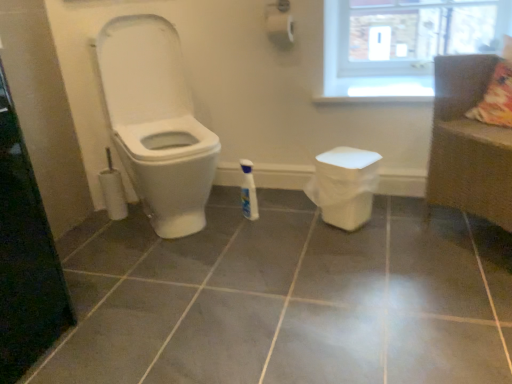
Question: Does white glossy bottle at center have a larger size compared to white glossy toilet at left?

Choices:
 (A) yes
 (B) no

Answer: (B)

Question: Can you confirm if white glossy bottle at center is positioned to the left of white glossy toilet at left?

Choices:
 (A) no
 (B) yes

Answer: (A)

Question: Can you confirm if white glossy bottle at center is wider than white glossy toilet at left?

Choices:
 (A) yes
 (B) no

Answer: (B)

Question: From a real-world perspective, does white glossy bottle at center sit lower than white glossy toilet at left?

Choices:
 (A) no
 (B) yes

Answer: (B)

Question: Is white glossy bottle at center not near white glossy toilet at left?

Choices:
 (A) no
 (B) yes

Answer: (A)

Question: Would you say transparent glass screen door at left is to the left or to the right of brown woven couch at right in the picture?

Choices:
 (A) right
 (B) left

Answer: (B)

Question: Is point 2,261 positioned closer to the camera than point 481,77?

Choices:
 (A) closer
 (B) farther

Answer: (A)

Question: Is transparent glass screen door at left taller or shorter than brown woven couch at right?

Choices:
 (A) tall
 (B) short

Answer: (B)

Question: Considering their positions, is transparent glass screen door at left located in front of or behind brown woven couch at right?

Choices:
 (A) front
 (B) behind

Answer: (A)

Question: Is white glossy bottle at center in front of or behind transparent glass screen door at left in the image?

Choices:
 (A) front
 (B) behind

Answer: (B)

Question: Would you say white glossy bottle at center is to the left or to the right of transparent glass screen door at left in the picture?

Choices:
 (A) left
 (B) right

Answer: (B)

Question: Considering the positions of white glossy bottle at center and transparent glass screen door at left in the image, is white glossy bottle at center taller or shorter than transparent glass screen door at left?

Choices:
 (A) short
 (B) tall

Answer: (A)

Question: Considering the positions of point (251, 193) and point (37, 266), is point (251, 193) closer or farther from the camera than point (37, 266)?

Choices:
 (A) closer
 (B) farther

Answer: (B)

Question: In the image, is brown woven couch at right positioned in front of or behind white glossy toilet at left?

Choices:
 (A) front
 (B) behind

Answer: (A)

Question: In terms of height, does brown woven couch at right look taller or shorter compared to white glossy toilet at left?

Choices:
 (A) short
 (B) tall

Answer: (A)